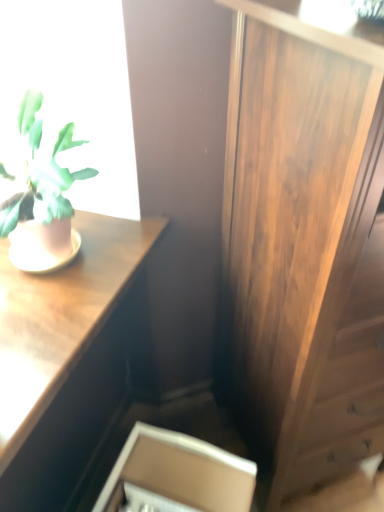
The width and height of the screenshot is (384, 512). Identify the location of vacant region to the right of pink matte flowerpot at left. (115, 248).